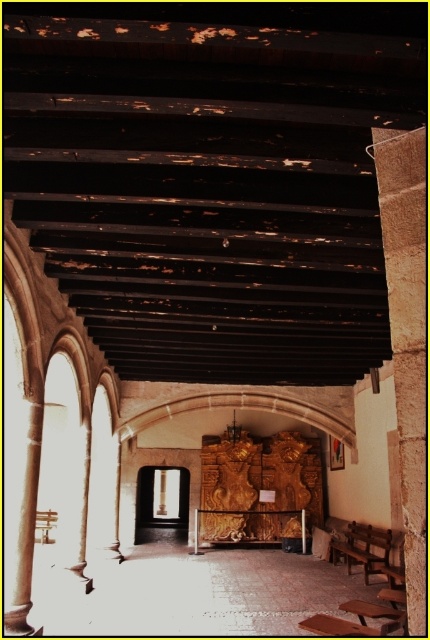
Question: Is the position of brown stone pillar at right more distant than that of wooden bench at lower right?

Choices:
 (A) yes
 (B) no

Answer: (B)

Question: Estimate the real-world distances between objects in this image. Which object is farther from the brown stone pillar at right?

Choices:
 (A) wooden bench at lower right
 (B) wooden bench at center

Answer: (A)

Question: Which point is farther from the camera taking this photo?

Choices:
 (A) pos(386,561)
 (B) pos(423,307)

Answer: (A)

Question: Is brown stone pillar at right to the right of wooden bench at lower right from the viewer's perspective?

Choices:
 (A) yes
 (B) no

Answer: (B)

Question: Which object is farther from the camera taking this photo?

Choices:
 (A) wooden bench at center
 (B) wooden bench at lower right

Answer: (B)

Question: Observing the image, what is the correct spatial positioning of brown stone pillar at right in reference to wooden bench at lower right?

Choices:
 (A) right
 (B) left

Answer: (B)